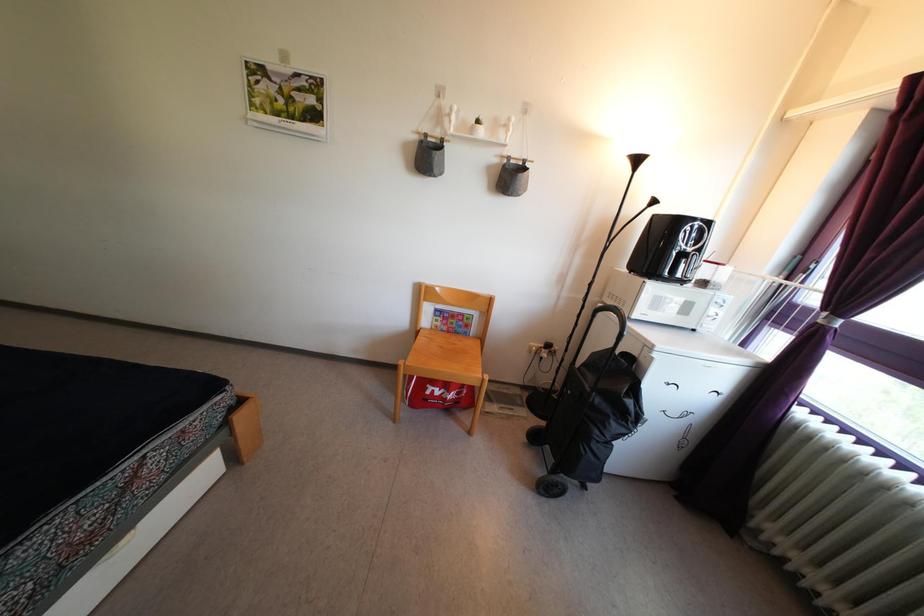
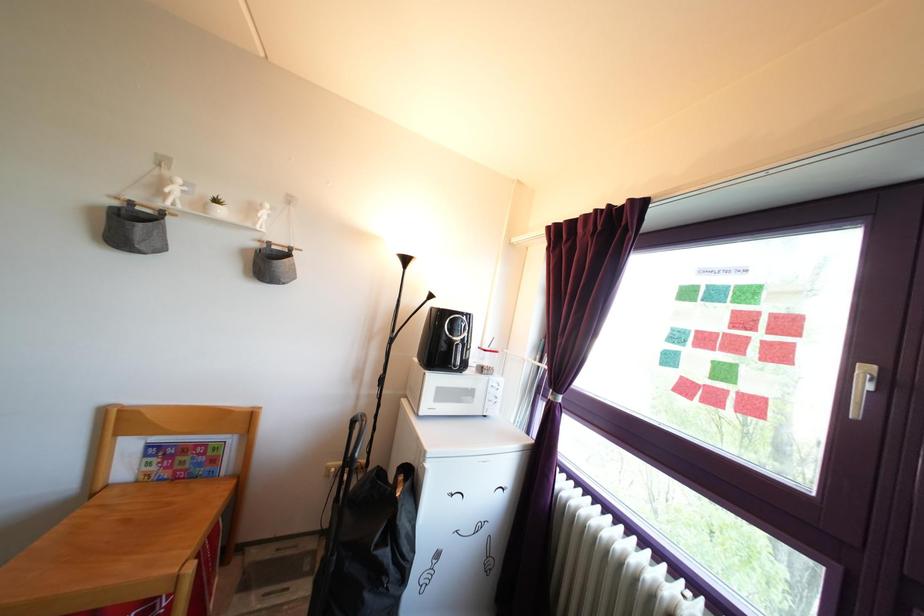
The point at (x=711, y=232) is marked in the first image. Where is the corresponding point in the second image?

(470, 323)